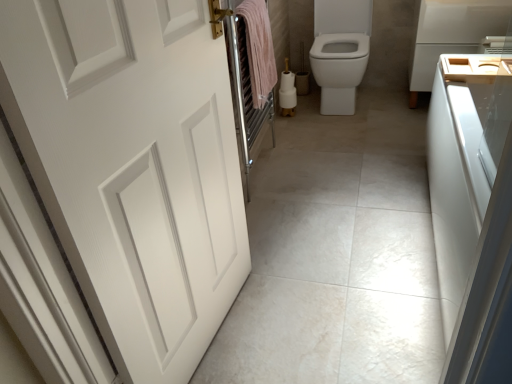
Question: Is wooden tray at right bigger or smaller than wooden sink at right?

Choices:
 (A) big
 (B) small

Answer: (A)

Question: Does point (465, 13) appear closer or farther from the camera than point (487, 64)?

Choices:
 (A) farther
 (B) closer

Answer: (A)

Question: Which is nearer to the wooden tray at right?

Choices:
 (A) wooden sink at right
 (B) white matte door at left
 (C) pink cotton towel at center
 (D) white glossy bidet at center

Answer: (D)

Question: Considering the real-world distances, which object is closest to the pink cotton towel at center?

Choices:
 (A) wooden tray at right
 (B) white glossy bidet at center
 (C) wooden sink at right
 (D) white matte door at left

Answer: (B)